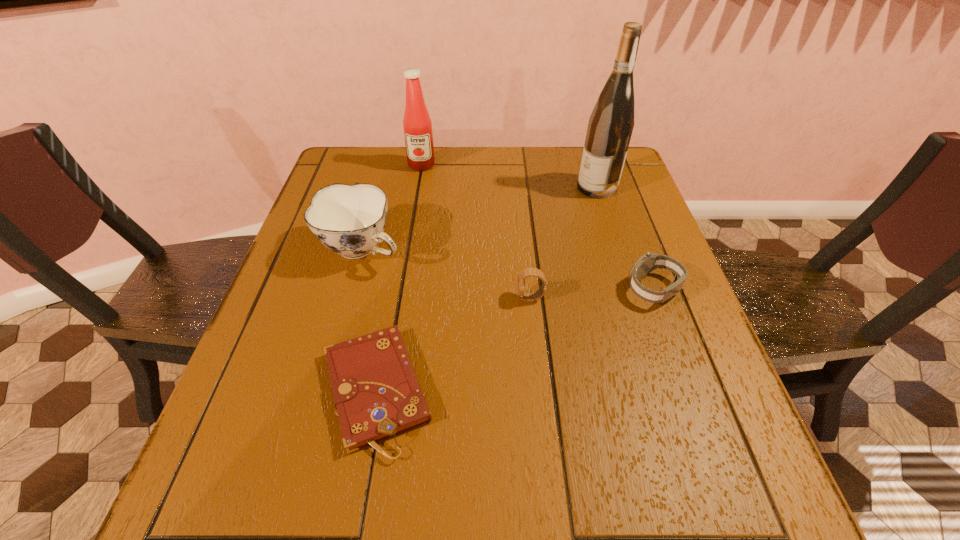
What are the coordinates of `condiment present at the far edge` in the screenshot? It's located at click(x=417, y=124).

You are a GUI agent. You are given a task and a screenshot of the screen. Output one action in this format:
    pyautogui.click(x=<x>, y=<y>)
    Task: Click on the chinaware that is at the left edge
    Image resolution: width=960 pixels, height=540 pixels.
    Given the screenshot: What is the action you would take?
    pyautogui.click(x=348, y=219)

Where is `notebook present at the left edge`? This screenshot has height=540, width=960. notebook present at the left edge is located at coordinates (376, 393).

This screenshot has height=540, width=960. Find the location of `wine bottle at the right edge`. wine bottle at the right edge is located at coordinates (610, 126).

Find the location of a particular element. watch at the right edge is located at coordinates (649, 261).

Find the location of a particular element. The width and height of the screenshot is (960, 540). object positioned at the far right corner is located at coordinates (610, 126).

Find the location of `vacant region at the far edge of the desktop`. vacant region at the far edge of the desktop is located at coordinates (546, 156).

The image size is (960, 540). I want to click on vacant space at the near edge of the desktop, so click(x=661, y=515).

Find the location of a particular element. Image resolution: width=960 pixels, height=540 pixels. vacant space at the left edge is located at coordinates (296, 331).

At what (x,y) coordinates should I click in order to perform the action: click on vacant space at the right edge. Please return your answer as a coordinate pair (x, y). The height and width of the screenshot is (540, 960). Looking at the image, I should click on (685, 405).